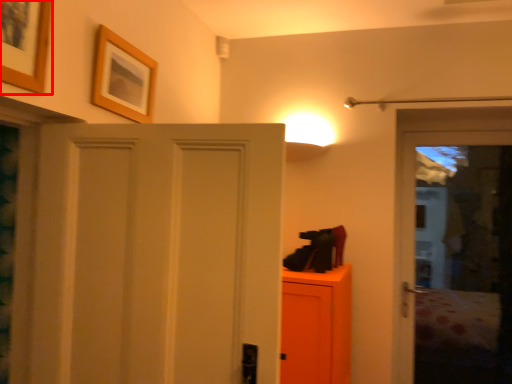
Question: From the image's perspective, what is the correct spatial positioning of picture frame (annotated by the red box) in reference to picture frame?

Choices:
 (A) below
 (B) above

Answer: (B)